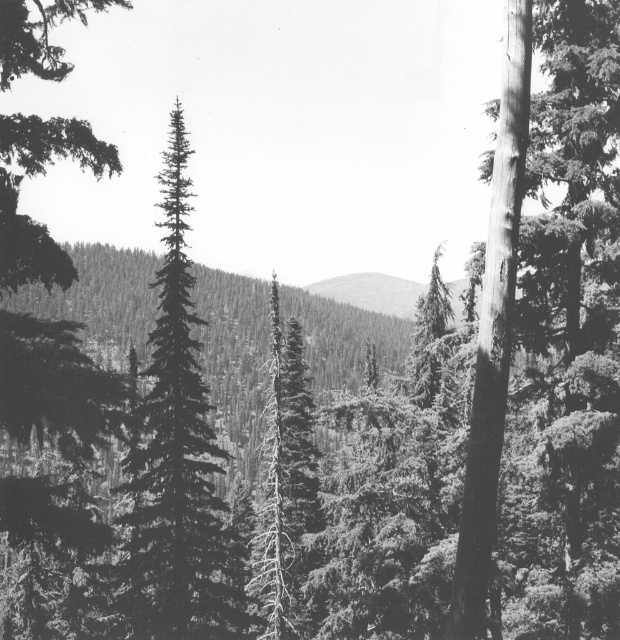
Does smooth bark tree at center appear over smooth gray mountain at center?

Incorrect, smooth bark tree at center is not positioned above smooth gray mountain at center.

Does smooth bark tree at center have a smaller size compared to smooth gray mountain at center?

Correct, smooth bark tree at center occupies less space than smooth gray mountain at center.

Locate an element on the screen. Image resolution: width=620 pixels, height=640 pixels. smooth bark tree at center is located at coordinates (283, 483).

This screenshot has width=620, height=640. I want to click on smooth bark tree at center, so click(x=283, y=483).

Which is below, smooth dark green tree at left or smooth gray mountain at center?

smooth gray mountain at center is lower down.

This screenshot has width=620, height=640. Find the location of `smooth dark green tree at left`. smooth dark green tree at left is located at coordinates (35, 173).

Where is `smooth dark green tree at left`? This screenshot has width=620, height=640. smooth dark green tree at left is located at coordinates (35, 173).

Is dark green textured pine tree at center to the left of smooth dark green tree at left from the viewer's perspective?

Incorrect, dark green textured pine tree at center is not on the left side of smooth dark green tree at left.

Which of these two, dark green textured pine tree at center or smooth dark green tree at left, stands taller?

smooth dark green tree at left is taller.

You are a GUI agent. You are given a task and a screenshot of the screen. Output one action in this format:
    pyautogui.click(x=<x>, y=<y>)
    Task: Click on the dark green textured pine tree at center
    This screenshot has width=620, height=640.
    Given the screenshot: What is the action you would take?
    pyautogui.click(x=177, y=460)

In order to click on dark green textured pine tree at center in this screenshot , I will do `click(177, 460)`.